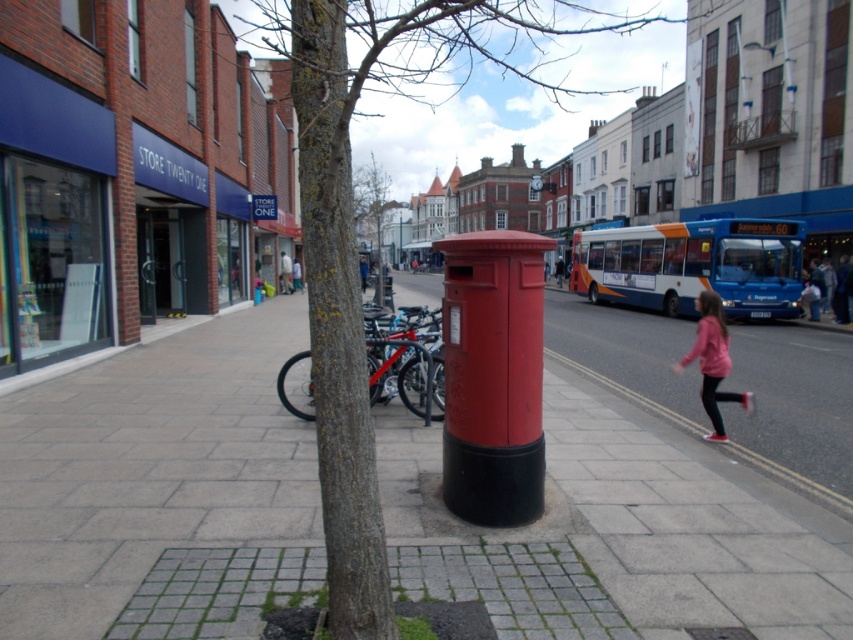
Question: Which point is farther to the camera?

Choices:
 (A) smooth concrete pavement at center
 (B) pink fabric girl at lower right
 (C) green rough bark tree at center
 (D) blue metallic bus at center

Answer: (D)

Question: Which point is closer to the camera?

Choices:
 (A) green rough bark tree at upper center
 (B) green rough bark tree at center
 (C) pink fabric girl at lower right

Answer: (B)

Question: Does blue metallic bus at center appear on the left side of pink fabric girl at lower right?

Choices:
 (A) yes
 (B) no

Answer: (B)

Question: Is smooth concrete pavement at center positioned in front of green rough bark tree at upper center?

Choices:
 (A) yes
 (B) no

Answer: (A)

Question: Is green rough bark tree at center wider than green rough bark tree at upper center?

Choices:
 (A) yes
 (B) no

Answer: (A)

Question: Which of the following is the closest to the observer?

Choices:
 (A) smooth concrete pavement at center
 (B) green rough bark tree at upper center

Answer: (A)